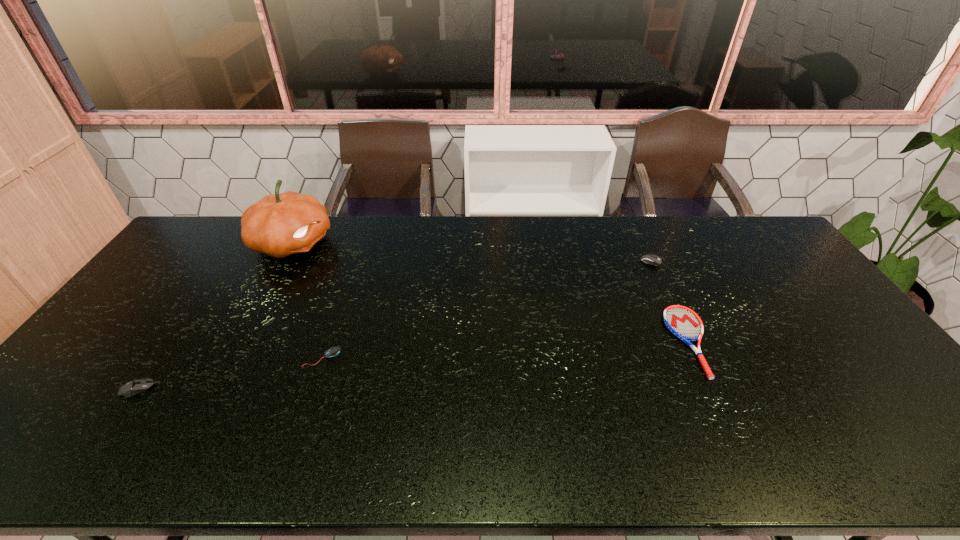
This screenshot has width=960, height=540. In order to click on the tallest object in this screenshot , I will do coord(279,225).

You are a GUI agent. You are given a task and a screenshot of the screen. Output one action in this format:
    pyautogui.click(x=<x>, y=<y>)
    Task: Click on the farthest mouse
    The image size is (960, 540).
    Given the screenshot: What is the action you would take?
    pyautogui.click(x=650, y=259)

Identify the location of the leftmost mouse. The width and height of the screenshot is (960, 540). (133, 387).

I want to click on the nearest mouse, so tap(133, 387).

Where is `tennis racket`? tennis racket is located at coordinates (684, 323).

What are the coordinates of `the second nearest mouse` in the screenshot? It's located at (334, 351).

Locate an element on the screen. the third object from right to left is located at coordinates (334, 351).

Find the location of a particular element. vacant space located on the front face of the pumpkin is located at coordinates (442, 243).

Find the location of `vacant space located on the right of the farthest mouse`. vacant space located on the right of the farthest mouse is located at coordinates (752, 259).

Identify the location of vacant space located on the right of the leftmost mouse. (276, 389).